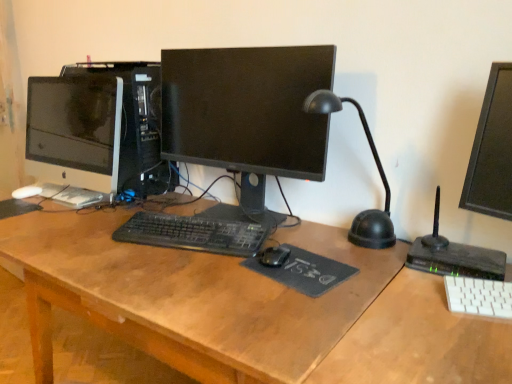
Image resolution: width=512 pixels, height=384 pixels. Find the location of `free point below black plastic desk lamp at center right (from a real-world perspective)`. free point below black plastic desk lamp at center right (from a real-world perspective) is located at coordinates (348, 243).